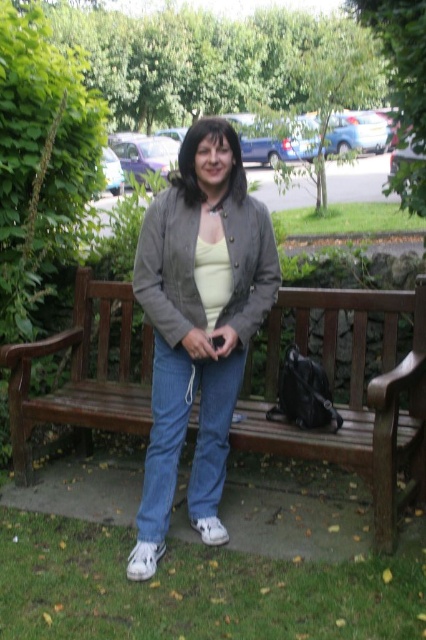
You are a photographer trying to capture a photo of the brown wooden bench at center. However, the matte gray jacket at center is blocking your view. Can you move the bench to the right to avoid the jacket?

The matte gray jacket at center is to the left of the brown wooden bench at center. To avoid the jacket, you can move the bench to the right side of the jacket.

You are a photographer trying to capture a photo of the brown wooden bench at center. However, the matte gray jacket at center is blocking your view. Can you estimate if the bench is shorter than the jacket?

The matte gray jacket at center is taller than brown wooden bench at center, so yes, the bench is shorter than the jacket.

You are a delivery person carrying a package that is 24 inches long. You need to place it between the matte gray jacket at center and the brown wooden bench at center. Is there enough space to fit the package between them?

The matte gray jacket at center and brown wooden bench at center are 23.99 inches apart from each other. Since the package is 24 inches long, there is not enough space to fit it between them.